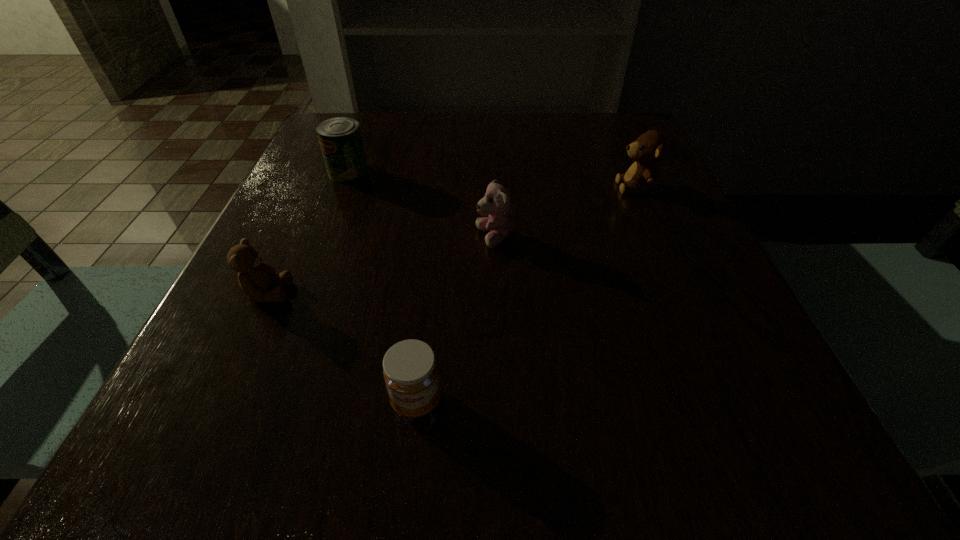
Locate an element on the screen. Image resolution: width=960 pixels, height=540 pixels. object present at the right edge is located at coordinates (648, 149).

At what (x,y) coordinates should I click in order to perform the action: click on free region at the far edge of the desktop. Please return your answer as a coordinate pair (x, y). Image resolution: width=960 pixels, height=540 pixels. Looking at the image, I should click on (553, 138).

Locate an element on the screen. Image resolution: width=960 pixels, height=540 pixels. blank space at the near edge of the desktop is located at coordinates (443, 459).

I want to click on vacant space at the left edge of the desktop, so click(x=292, y=235).

You are a GUI agent. You are given a task and a screenshot of the screen. Output one action in this format:
    pyautogui.click(x=<x>, y=<y>)
    Task: Click on the vacant space at the right edge
    
    Given the screenshot: What is the action you would take?
    [x=661, y=185]

This screenshot has width=960, height=540. Find the location of `vacant space at the far left corner`. vacant space at the far left corner is located at coordinates (377, 146).

In the image, there is a desktop. Identify the location of free space at the far right corner. Image resolution: width=960 pixels, height=540 pixels. coord(590,134).

Find the location of a particular element. This screenshot has width=960, height=540. vacant region at the near right corner of the desktop is located at coordinates (696, 421).

Where is `vacant area that lies between the can and the second nearest teddy bear`? vacant area that lies between the can and the second nearest teddy bear is located at coordinates (421, 205).

Where is `blank region between the third object from right to left and the nearest teddy bear`? This screenshot has width=960, height=540. blank region between the third object from right to left and the nearest teddy bear is located at coordinates (343, 347).